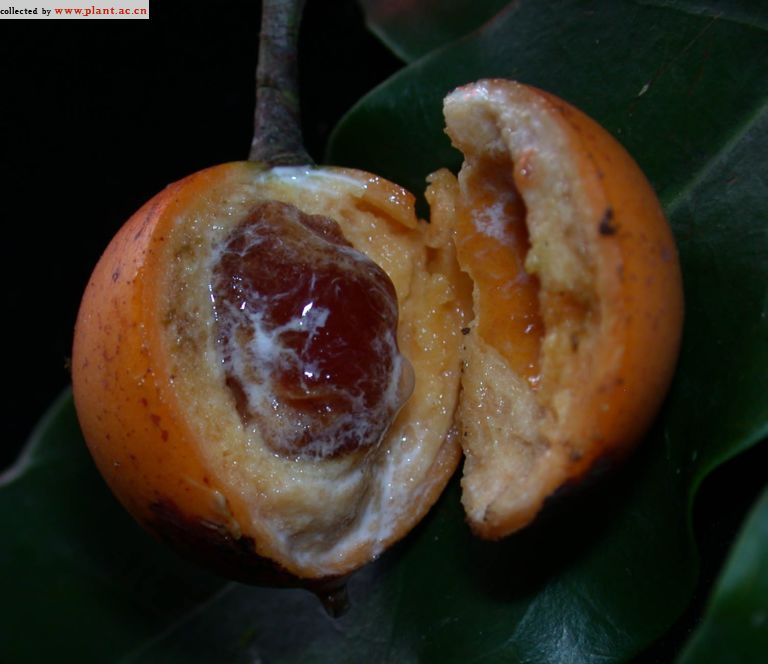
This screenshot has width=768, height=664. I want to click on plant, so click(280, 18).